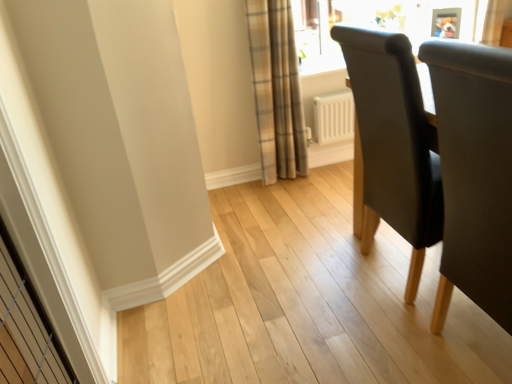
I want to click on vacant area located to the right-hand side of plaid fabric curtain at upper center, so click(325, 180).